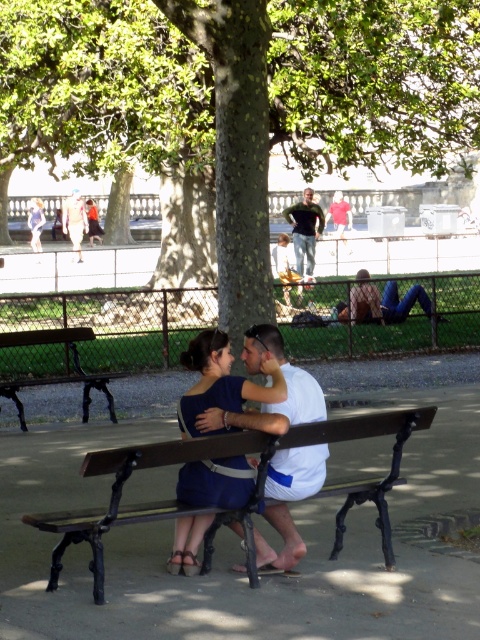
You are standing at the point labeled as point (238, 100) in the park scene. What object is located exactly at this point?

The point (238, 100) corresponds to the green textured tree at center.

You are a photographer standing in the park and want to take a photo of the green textured tree at center and the dark blue jeans at center. Which object should you focus on first to ensure both are in focus?

The green textured tree at center is in front of the dark blue jeans at center, so you should focus on the green textured tree at center first to ensure both are in focus.

You are a photographer trying to capture a candid shot of the two people sitting on the bench. You notice the white matte shirt at center and the dark blue jeans at center. Which clothing item is closer to the camera?

The white matte shirt at center is shorter than dark blue jeans at center, so it is closer to the camera since shorter objects appear closer in perspective.